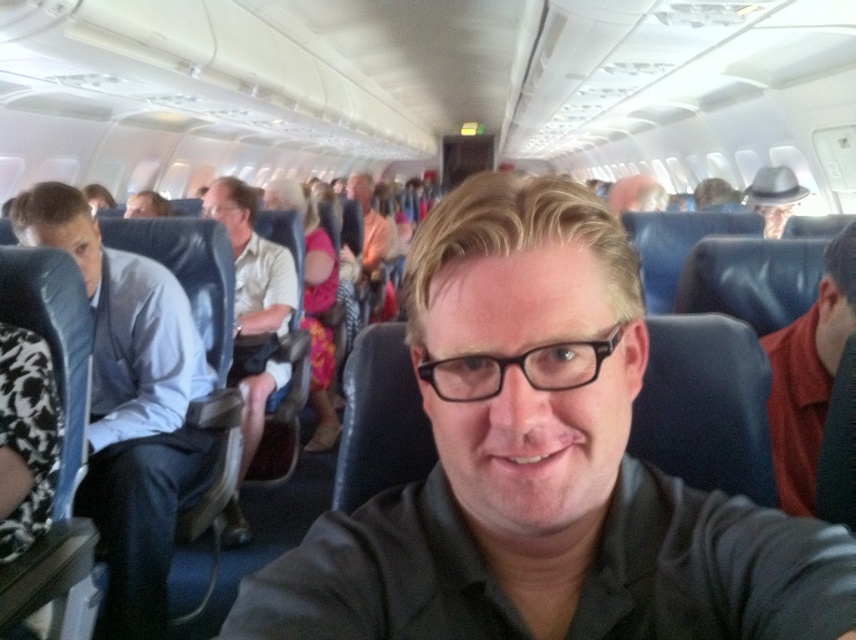
Question: Which point is farther to the camera?

Choices:
 (A) (777, 168)
 (B) (85, 488)
 (C) (244, 472)

Answer: (A)

Question: Is black matte shirt at center positioned behind pink floral dress at center?

Choices:
 (A) no
 (B) yes

Answer: (A)

Question: Can you confirm if black matte shirt at center is smaller than pink floral dress at center?

Choices:
 (A) yes
 (B) no

Answer: (A)

Question: Which object is positioned farthest from the light blue shirt at left?

Choices:
 (A) light beige shirt at center
 (B) matte black hat at upper center
 (C) matte gray hat at upper right

Answer: (C)

Question: Can you confirm if black matte shirt at center is positioned above light beige shirt at center?

Choices:
 (A) yes
 (B) no

Answer: (B)

Question: Which of the following is the farthest from the observer?

Choices:
 (A) (239, 236)
 (B) (620, 208)
 (C) (791, 556)

Answer: (B)